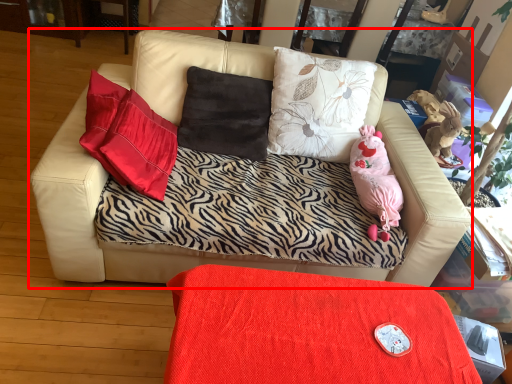
Question: Observing the image, what is the correct spatial positioning of studio couch (annotated by the red box) in reference to table?

Choices:
 (A) left
 (B) right

Answer: (A)